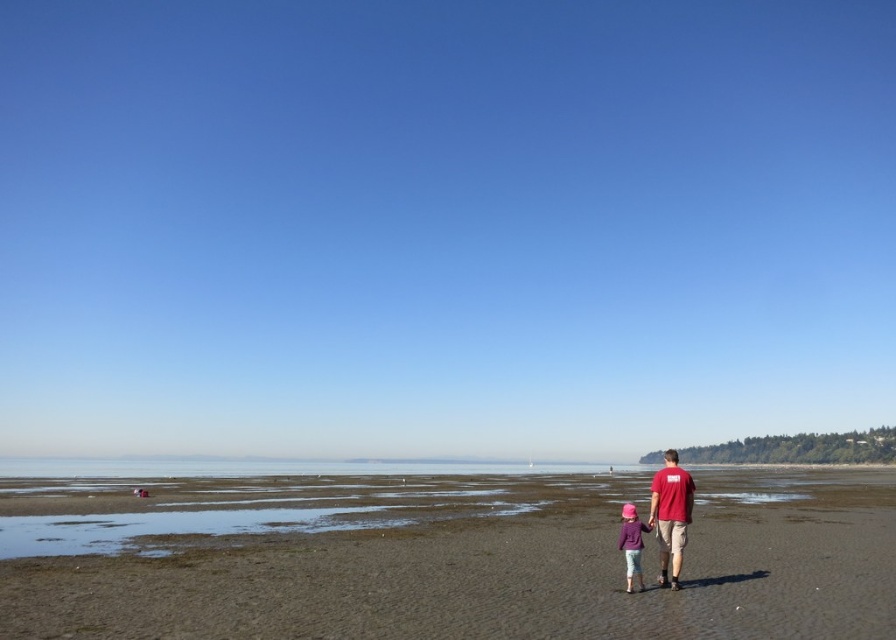
Is matte red t-shirt at right to the right of pink fabric hat at lower center from the viewer's perspective?

Indeed, matte red t-shirt at right is positioned on the right side of pink fabric hat at lower center.

In order to click on matte red t-shirt at right in this screenshot , I will do `click(670, 515)`.

How far apart are brown sandy beach at lower center and pink fabric hat at lower center?

The distance of brown sandy beach at lower center from pink fabric hat at lower center is 54.95 meters.

Is point (259, 557) more distant than point (638, 536)?

Yes.

This screenshot has height=640, width=896. I want to click on brown sandy beach at lower center, so click(438, 556).

Does brown sandy beach at lower center appear under matte red t-shirt at right?

Correct, brown sandy beach at lower center is located below matte red t-shirt at right.

Is brown sandy beach at lower center behind matte red t-shirt at right?

No, brown sandy beach at lower center is in front of matte red t-shirt at right.

This screenshot has height=640, width=896. Describe the element at coordinates (438, 556) in the screenshot. I see `brown sandy beach at lower center` at that location.

The height and width of the screenshot is (640, 896). I want to click on brown sandy beach at lower center, so click(438, 556).